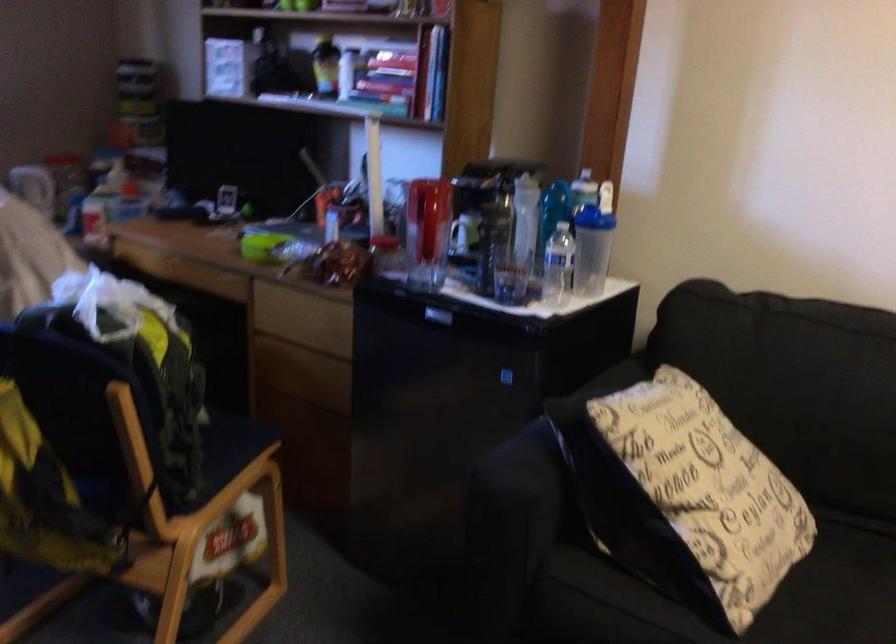
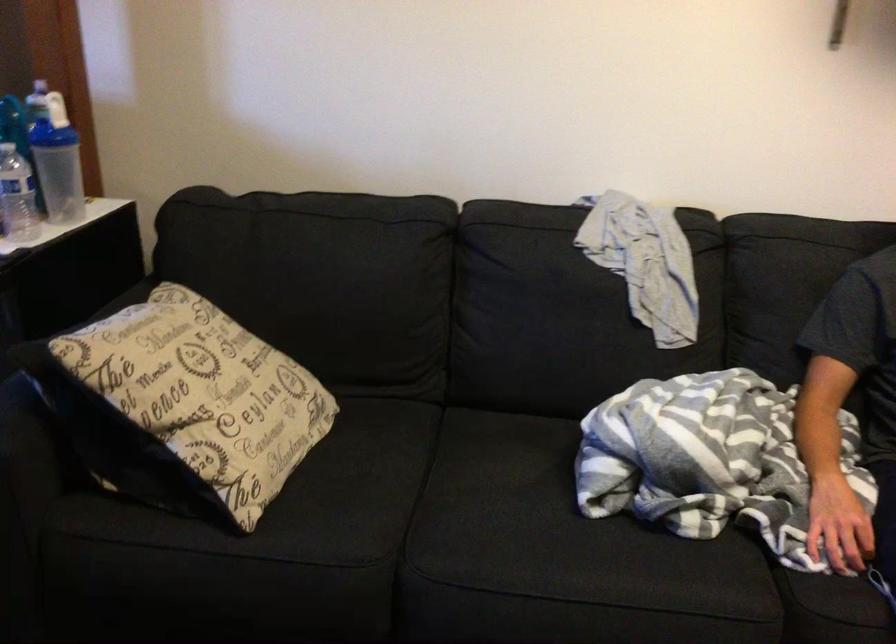
The point at (584,172) is marked in the first image. Where is the corresponding point in the second image?

(40, 80)